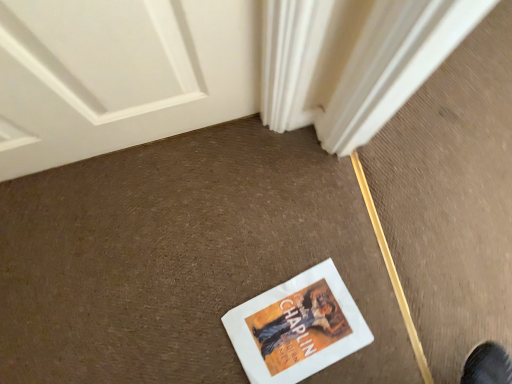
What do you see at coordinates (297, 327) in the screenshot?
I see `white paper magazine at center` at bounding box center [297, 327].

Locate an element on the screen. The height and width of the screenshot is (384, 512). white paper magazine at center is located at coordinates (297, 327).

Locate an element on the screen. The width and height of the screenshot is (512, 384). white paper magazine at center is located at coordinates (297, 327).